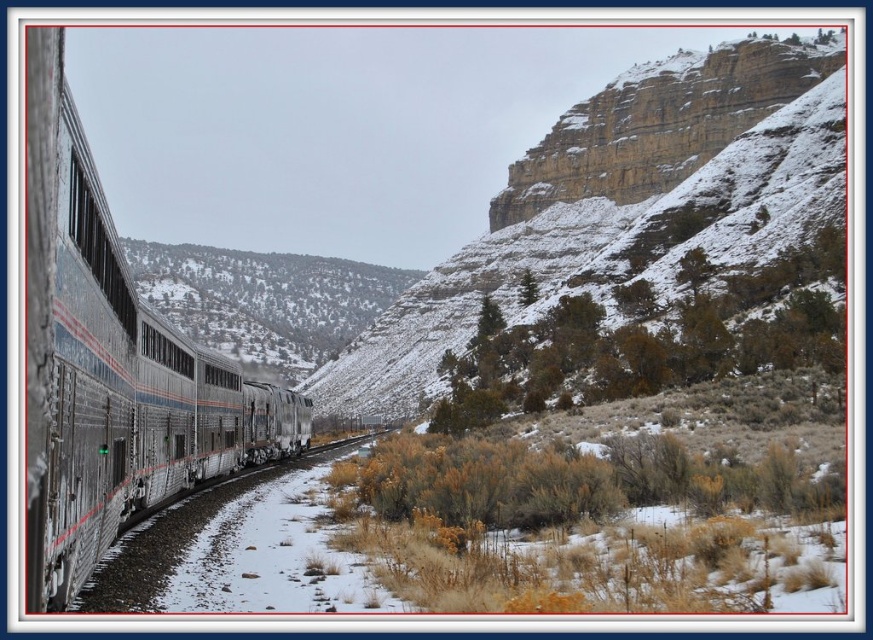
You are on the passenger train with a sleek, silver exterior accented by red and blue stripes. You notice two points marked in the scene. The first point is at coordinates point (x=715, y=81) and the second is at point (x=33, y=342). From your position on the train, which point is closer to you?

Point (x=33, y=342) is closer to you because it is in front of point (x=715, y=81).

From the picture: You are a train engineer operating the silver metallic train at left on a single track railway. The snowy rocky cliff at upper right is visible in the distance. Can you safely pass through this section of the track without stopping?

The distance between the snowy rocky cliff at upper right and the silver metallic train at left is 327.85 feet. Since the track is single and the cliff is not blocking the path, the train can safely proceed without stopping.

You are standing at the point marked as point (623, 204) on the image. What can you see in the direction of the passenger train with a sleek silver exterior accented by red and blue stripes?

The point (623, 204) corresponds to a snowy rocky cliff at upper right, so you would see the passenger train with a sleek silver exterior accented by red and blue stripes in the distance as it moves along the railway line.